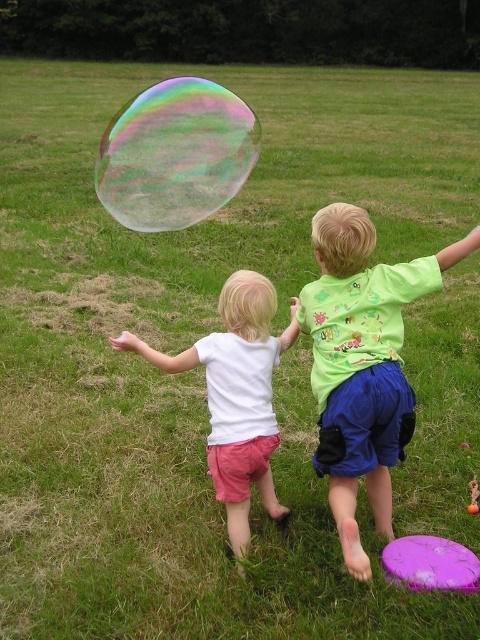
Question: Which point appears closest to the camera in this image?

Choices:
 (A) (229, 164)
 (B) (335, 225)
 (C) (446, 579)
 (D) (255, 291)

Answer: (C)

Question: Does transparent iridescent bubble at upper center have a larger size compared to purple matte frisbee at lower right?

Choices:
 (A) no
 (B) yes

Answer: (B)

Question: Is green cotton shirt at center smaller than transparent iridescent bubble at upper center?

Choices:
 (A) yes
 (B) no

Answer: (A)

Question: Based on their relative distances, which object is nearer to the purple matte frisbee at lower right?

Choices:
 (A) green cotton shirt at center
 (B) white matte shirt at center
 (C) transparent iridescent bubble at upper center

Answer: (A)

Question: Can you confirm if transparent iridescent bubble at upper center is bigger than purple matte frisbee at lower right?

Choices:
 (A) no
 (B) yes

Answer: (B)

Question: Among these objects, which one is farthest from the camera?

Choices:
 (A) purple matte frisbee at lower right
 (B) white matte shirt at center

Answer: (B)